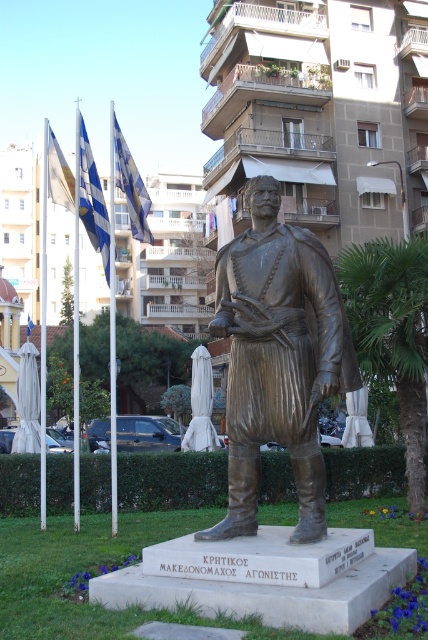
Who is more distant from viewer, (x=101, y=211) or (x=55, y=188)?

Point (x=55, y=188)

Which is above, blue and white striped flag at left or blue-white striped flag at upper left?

blue and white striped flag at left

Which is in front, point (83, 156) or point (56, 161)?

Point (83, 156) is in front.

Find the location of a particular element. Image resolution: width=428 pixels, height=640 pixels. blue and white striped flag at left is located at coordinates (92, 198).

Is green leafy palm tree at center taller than blue fabric flag at left?

Indeed, green leafy palm tree at center has a greater height compared to blue fabric flag at left.

Which is more to the right, green leafy palm tree at center or blue fabric flag at left?

green leafy palm tree at center is more to the right.

Describe the element at coordinates (392, 333) in the screenshot. The height and width of the screenshot is (640, 428). I see `green leafy palm tree at center` at that location.

The image size is (428, 640). I want to click on green leafy palm tree at center, so click(x=392, y=333).

From the picture: Which of these two, bronze statue at center or blue fabric flag at upper left, stands taller?

blue fabric flag at upper left is taller.

Based on the photo, does bronze statue at center lie in front of blue fabric flag at upper left?

Yes.

Which is behind, point (255, 246) or point (136, 177)?

Positioned behind is point (136, 177).

You are a GUI agent. You are given a task and a screenshot of the screen. Output one action in this format:
    pyautogui.click(x=<x>, y=<y>)
    Task: Click on the bronze statue at center
    This screenshot has height=640, width=428.
    Given the screenshot: What is the action you would take?
    tap(278, 358)